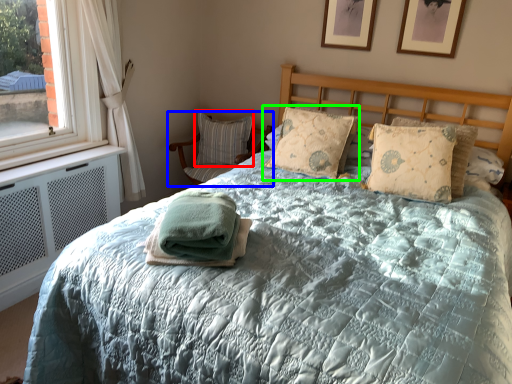
Question: Which object is the farthest from pillow (highlighted by a red box)? Choose among these: chair (highlighted by a blue box) or pillow (highlighted by a green box).

Choices:
 (A) chair
 (B) pillow

Answer: (B)